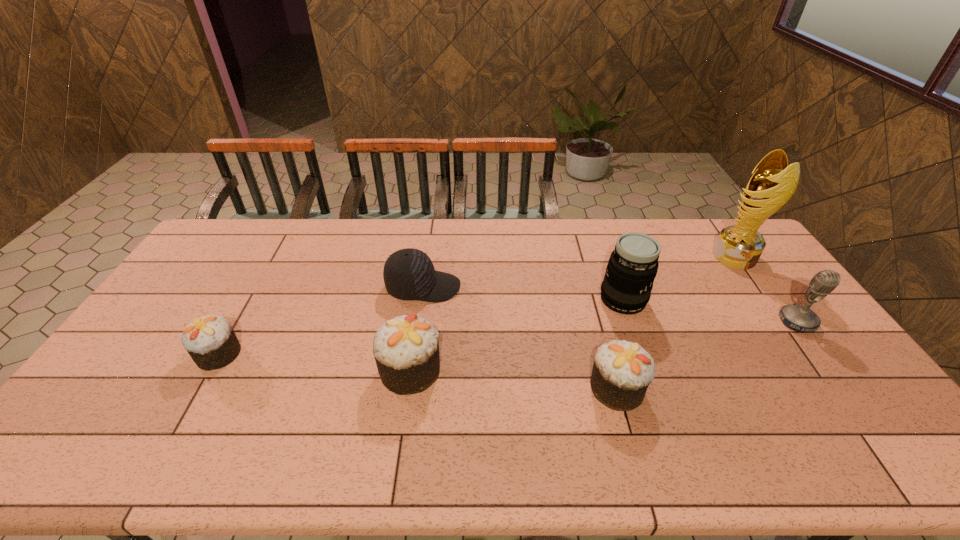
Find the location of `vacant space located on the back of the second cupcake from left to right`. vacant space located on the back of the second cupcake from left to right is located at coordinates (420, 302).

Where is `free space located 0.270m on the back of the second tallest cupcake`? The width and height of the screenshot is (960, 540). free space located 0.270m on the back of the second tallest cupcake is located at coordinates (592, 298).

Where is `vacant space located on the left of the telephoto lens`? This screenshot has height=540, width=960. vacant space located on the left of the telephoto lens is located at coordinates (509, 300).

At what (x,y) coordinates should I click in order to perform the action: click on free space located on the front-facing side of the tallest object. Please return your answer as a coordinate pair (x, y). Looking at the image, I should click on (691, 256).

What are the coordinates of `free space located 0.060m on the front-facing side of the tallest object` in the screenshot? It's located at (697, 256).

In order to click on free location located 0.360m on the front-facing side of the tallest object in this screenshot , I will do `click(613, 256)`.

I want to click on vacant area situated at the front of the baseball cap where the brim is located, so click(x=551, y=287).

The image size is (960, 540). Find the location of `vacant space situated on the front-facing side of the microphone`. vacant space situated on the front-facing side of the microphone is located at coordinates pos(831,368).

I want to click on object located in the far edge section of the desktop, so click(739, 246).

This screenshot has width=960, height=540. What are the coordinates of `award that is at the right edge` in the screenshot? It's located at (739, 246).